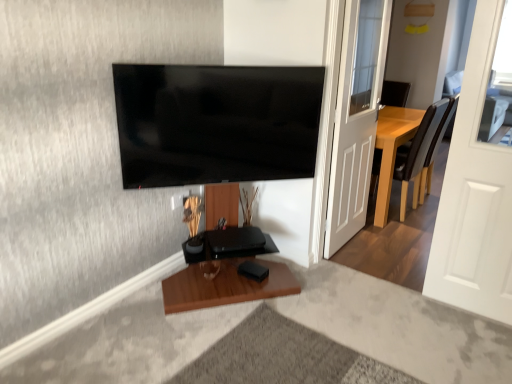
Where is `white matte door at right, placed as the second door when sorted from left to right`? This screenshot has height=384, width=512. white matte door at right, placed as the second door when sorted from left to right is located at coordinates (479, 179).

Between brown leather chair at right and white matte door at right, placed as the second door when sorted from left to right, which one has less height?

brown leather chair at right is shorter.

What's the angular difference between brown leather chair at right and white matte door at right, which is the second door from back to front,'s facing directions?

The facing directions of brown leather chair at right and white matte door at right, which is the second door from back to front, are 90.3 degrees apart.

Is brown leather chair at right at the right side of white matte door at right, arranged as the first door when viewed from the front?

Yes.

From the image's perspective, is brown leather chair at right positioned above or below white matte door at right, placed as the second door when sorted from left to right?

brown leather chair at right is above white matte door at right, placed as the second door when sorted from left to right.

Is the surface of brown leather chair at right in direct contact with flat screen tv at upper center?

No, brown leather chair at right is not next to flat screen tv at upper center.

In terms of height, does brown leather chair at right look taller or shorter compared to flat screen tv at upper center?

Clearly, brown leather chair at right is taller compared to flat screen tv at upper center.

From a real-world perspective, is brown leather chair at right located higher than flat screen tv at upper center?

No.

Considering the positions of objects brown leather chair at right and flat screen tv at upper center in the image provided, who is behind, brown leather chair at right or flat screen tv at upper center?

brown leather chair at right is more distant.

Is white glossy door at right, the 2th door from the right, positioned with its back to white matte door at right, the 1th door from the right?

white glossy door at right, the 2th door from the right, does not have its back to white matte door at right, the 1th door from the right.

Between white glossy door at right, marked as the second door in a front-to-back arrangement, and white matte door at right, arranged as the first door when viewed from the front, which one has more height?

white glossy door at right, marked as the second door in a front-to-back arrangement, is taller.

Is white glossy door at right, which is the first door from left to right, not inside white matte door at right, the 1th door from the right?

Absolutely, white glossy door at right, which is the first door from left to right, is external to white matte door at right, the 1th door from the right.

Which object is more forward, white glossy door at right, which is the first door from left to right, or white matte door at right, which is the second door from back to front?

white matte door at right, which is the second door from back to front, is closer to the camera.

Is the surface of flat screen tv at upper center in direct contact with white matte door at right, the 1th door from the right?

There is a gap between flat screen tv at upper center and white matte door at right, the 1th door from the right.

Which of these two, flat screen tv at upper center or white matte door at right, arranged as the first door when viewed from the front, stands taller?

With more height is white matte door at right, arranged as the first door when viewed from the front.

From a real-world perspective, which is physically above, flat screen tv at upper center or white matte door at right, arranged as the first door when viewed from the front?

flat screen tv at upper center, from a real-world perspective.

How much distance is there between flat screen tv at upper center and white matte door at right, which is the second door from back to front?

flat screen tv at upper center and white matte door at right, which is the second door from back to front, are 1.14 meters apart from each other.

Does brown leather chair at right touch white glossy door at right, which is counted as the first door, starting from the back?

No, brown leather chair at right is not making contact with white glossy door at right, which is counted as the first door, starting from the back.

Consider the image. Which is farther from the camera, [408,182] or [347,160]?

The point [408,182] is farther.

Is brown leather chair at right outside of white glossy door at right, which is counted as the first door, starting from the back?

Absolutely, brown leather chair at right is external to white glossy door at right, which is counted as the first door, starting from the back.

How different are the orientations of brown leather chair at right and white glossy door at right, marked as the second door in a front-to-back arrangement, in degrees?

brown leather chair at right and white glossy door at right, marked as the second door in a front-to-back arrangement, are facing 178 degrees away from each other.

Is the position of white glossy door at right, the 2th door from the right, less distant than that of brown leather chair at right?

Yes, it is in front of brown leather chair at right.

Is point (357, 65) more distant than point (422, 152)?

No, it is in front of (422, 152).

From the image's perspective, is white glossy door at right, which is counted as the first door, starting from the back, positioned above or below brown leather chair at right?

Based on their image positions, white glossy door at right, which is counted as the first door, starting from the back, is located beneath brown leather chair at right.

Is white glossy door at right, which is the first door from left to right, not inside brown leather chair at right?

Yes, white glossy door at right, which is the first door from left to right, is located beyond the bounds of brown leather chair at right.

Is white matte door at right, the 1th door from the right, oriented away from white glossy door at right, which is the first door from left to right?

No.

Which is less distant, (506, 268) or (351, 123)?

The point (506, 268) is closer to the camera.

Is white matte door at right, placed as the second door when sorted from left to right, to the left of white glossy door at right, which is the first door from left to right, from the viewer's perspective?

No, white matte door at right, placed as the second door when sorted from left to right, is not to the left of white glossy door at right, which is the first door from left to right.

At what (x,y) coordinates should I click in order to perform the action: click on door directly beneath the white glossy door at right, which is counted as the first door, starting from the back (from a real-world perspective). Please return your answer as a coordinate pair (x, y). This screenshot has width=512, height=384. Looking at the image, I should click on (479, 179).

You are a GUI agent. You are given a task and a screenshot of the screen. Output one action in this format:
    pyautogui.click(x=<x>, y=<y>)
    Task: Click on the 2nd door in front when counting from the brown leather chair at right
    The width and height of the screenshot is (512, 384).
    Given the screenshot: What is the action you would take?
    pyautogui.click(x=479, y=179)

This screenshot has width=512, height=384. I want to click on chair on the right side of flat screen tv at upper center, so click(407, 163).

Considering their positions, is brown leather chair at right positioned closer to white glossy door at right, which is the first door from left to right, than white matte door at right, which is the second door from back to front?

The object closer to white glossy door at right, which is the first door from left to right, is brown leather chair at right.

Which object lies further to the anchor point flat screen tv at upper center, white matte door at right, the 1th door from the right, or white glossy door at right, which is the first door from left to right?

white matte door at right, the 1th door from the right.

Estimate the real-world distances between objects in this image. Which object is further from brown leather chair at right, flat screen tv at upper center or white glossy door at right, the 2th door from the right?

flat screen tv at upper center is further to brown leather chair at right.

Looking at the image, which one is located further to white matte door at right, which is the second door from back to front, brown leather chair at right or flat screen tv at upper center?

flat screen tv at upper center.

When comparing their distances from flat screen tv at upper center, does white matte door at right, the 1th door from the right, or brown leather chair at right seem further?

brown leather chair at right lies further to flat screen tv at upper center than the other object.

Based on their spatial positions, is brown leather chair at right or white matte door at right, the 1th door from the right, closer to flat screen tv at upper center?

white matte door at right, the 1th door from the right, lies closer to flat screen tv at upper center than the other object.

When comparing their distances from brown leather chair at right, does flat screen tv at upper center or white matte door at right, placed as the second door when sorted from left to right, seem further?

Among the two, flat screen tv at upper center is located further to brown leather chair at right.

Consider the image. Considering their positions, is flat screen tv at upper center positioned further to white glossy door at right, marked as the second door in a front-to-back arrangement, than white matte door at right, which is the second door from back to front?

white matte door at right, which is the second door from back to front, is positioned further to the anchor white glossy door at right, marked as the second door in a front-to-back arrangement.

Find the location of a particular element. door located between white matte door at right, arranged as the first door when viewed from the front, and brown leather chair at right in the depth direction is located at coordinates (356, 118).

Identify the location of door situated between flat screen tv at upper center and white matte door at right, the 1th door from the right, from left to right. (356, 118).

Where is `television between white matte door at right, the 1th door from the right, and brown leather chair at right from front to back`? The width and height of the screenshot is (512, 384). television between white matte door at right, the 1th door from the right, and brown leather chair at right from front to back is located at coordinates (216, 123).